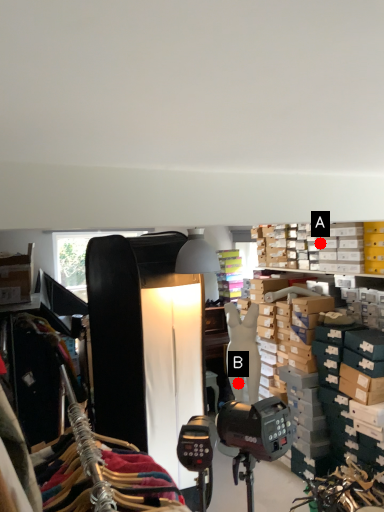
Question: Two points are circled on the image, labeled by A and B beside each circle. Which point is closer to the camera?

Choices:
 (A) A is closer
 (B) B is closer

Answer: (B)